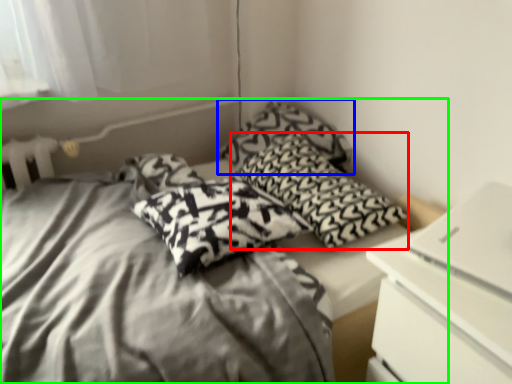
Question: Which is nearer to the pillow (highlighted by a red box)? pillow (highlighted by a blue box) or bed (highlighted by a green box).

Choices:
 (A) pillow
 (B) bed

Answer: (A)